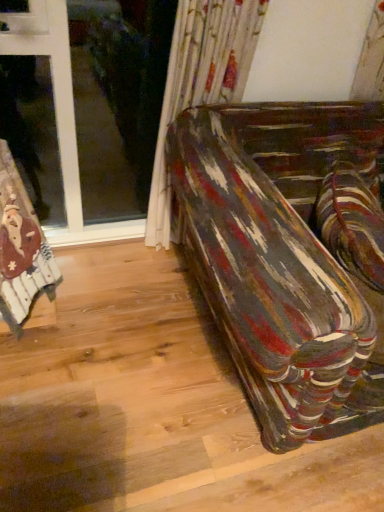
Where is `vacant area situated below white fabric tablecloth at left (from a real-world perspective)`? This screenshot has height=512, width=384. vacant area situated below white fabric tablecloth at left (from a real-world perspective) is located at coordinates (35, 312).